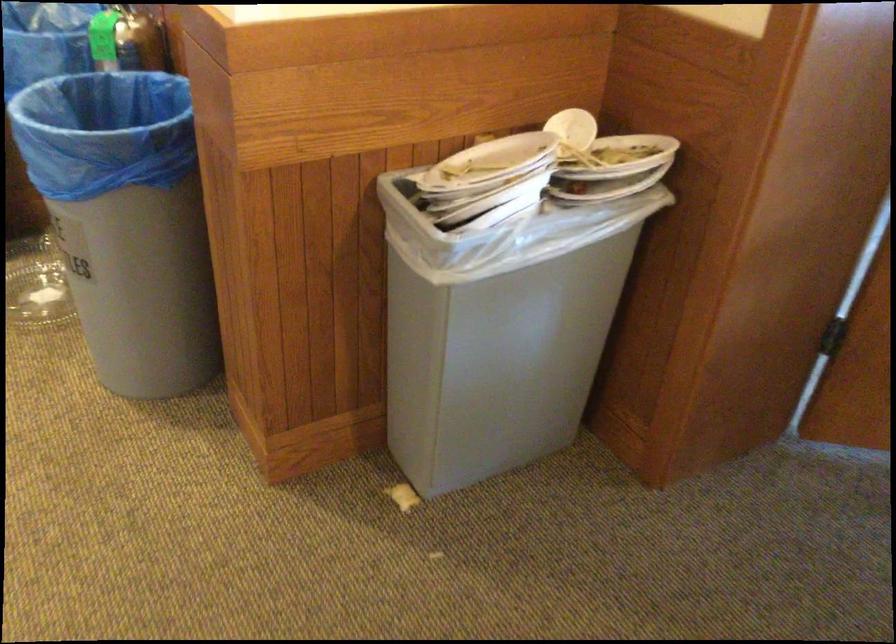
Identify the location of white trash bag edge. (487, 239).